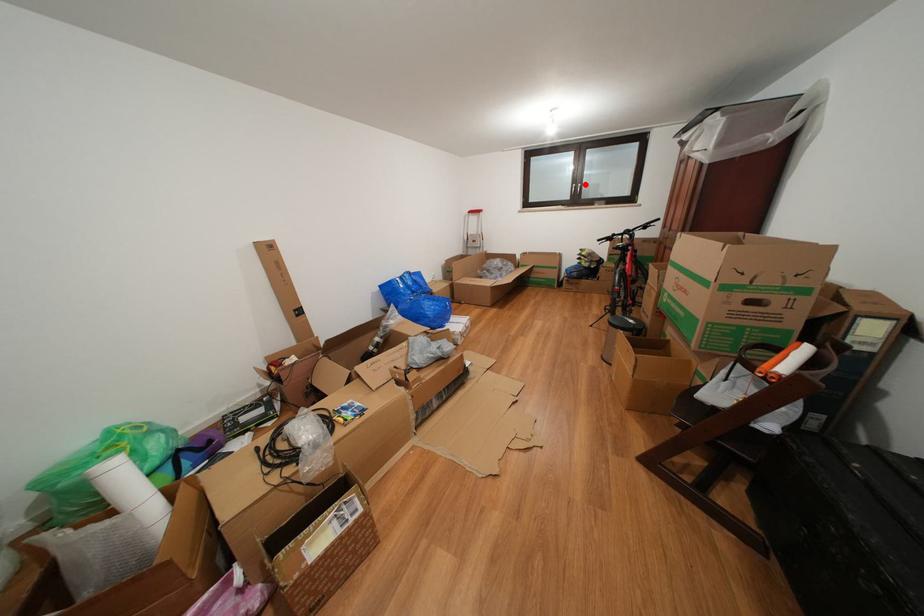
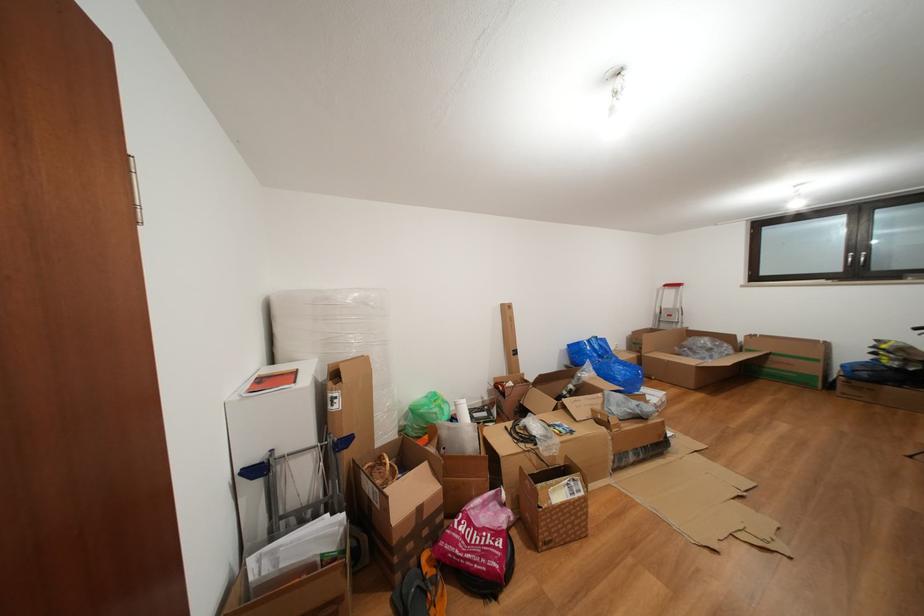
Question: I am providing you with two images of the same scene from different viewpoints. Given a red point in image1, look at the same physical point in image2. Is it:

Choices:
 (A) Closer to the viewpoint
 (B) Farther from the viewpoint

Answer: (B)